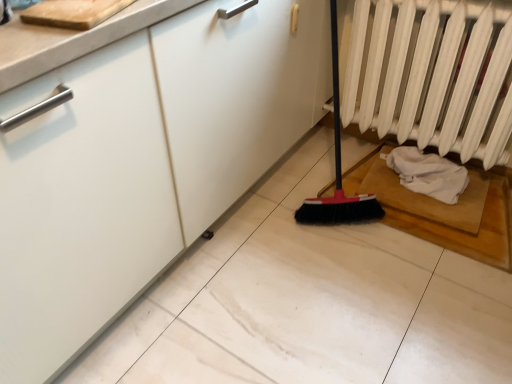
Question: Is white matte radiator at right smaller than white fabric at lower right?

Choices:
 (A) yes
 (B) no

Answer: (B)

Question: Is white matte radiator at right thinner than white fabric at lower right?

Choices:
 (A) no
 (B) yes

Answer: (B)

Question: From the image's perspective, would you say white matte radiator at right is shown under white fabric at lower right?

Choices:
 (A) yes
 (B) no

Answer: (B)

Question: Are white matte radiator at right and white fabric at lower right beside each other?

Choices:
 (A) yes
 (B) no

Answer: (B)

Question: From the image's perspective, is white matte radiator at right on top of white fabric at lower right?

Choices:
 (A) no
 (B) yes

Answer: (B)

Question: Does white matte radiator at right have a greater height compared to white fabric at lower right?

Choices:
 (A) no
 (B) yes

Answer: (B)

Question: Does white fabric at lower right appear on the left side of white matte radiator at right?

Choices:
 (A) yes
 (B) no

Answer: (B)

Question: From a real-world perspective, is white fabric at lower right over white matte radiator at right?

Choices:
 (A) no
 (B) yes

Answer: (A)

Question: From the image's perspective, does white fabric at lower right appear lower than white matte radiator at right?

Choices:
 (A) yes
 (B) no

Answer: (A)

Question: Is white fabric at lower right in contact with white matte radiator at right?

Choices:
 (A) no
 (B) yes

Answer: (A)

Question: Is the position of white fabric at lower right less distant than that of white matte radiator at right?

Choices:
 (A) no
 (B) yes

Answer: (A)

Question: Does white fabric at lower right have a greater height compared to white matte radiator at right?

Choices:
 (A) yes
 (B) no

Answer: (B)

Question: From the image's perspective, is white fabric at lower right positioned above or below white matte radiator at right?

Choices:
 (A) below
 (B) above

Answer: (A)